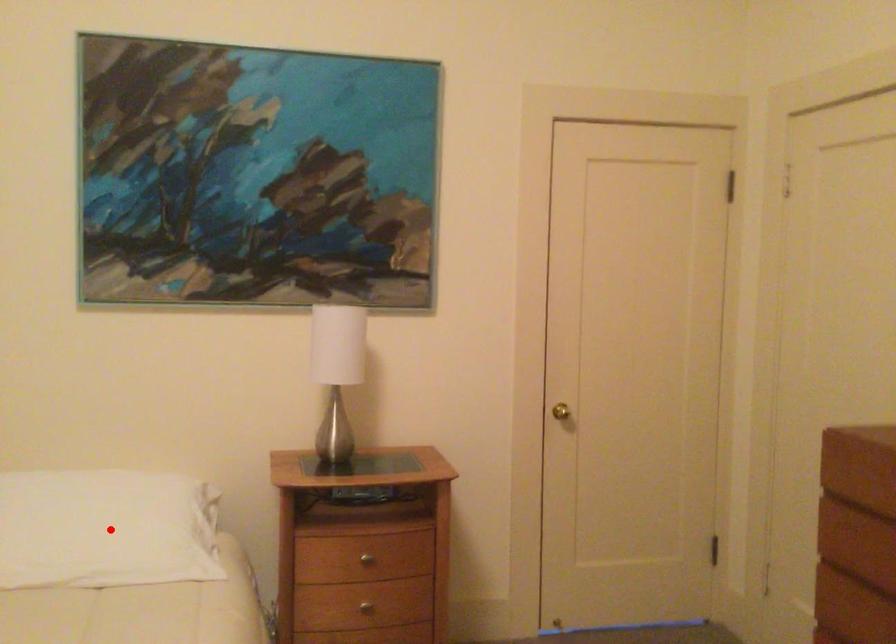
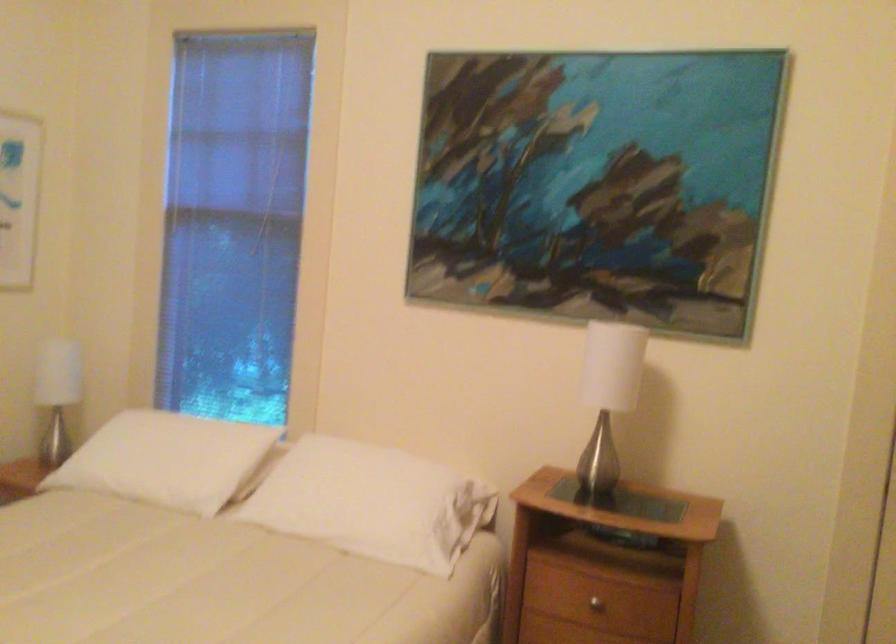
Question: I am providing you with two images of the same scene from different viewpoints. Image1 has a red point marked. In image2, the corresponding 3D location appears at what relative position? Reply with the corresponding letter.

Choices:
 (A) Closer
 (B) Farther

Answer: (B)